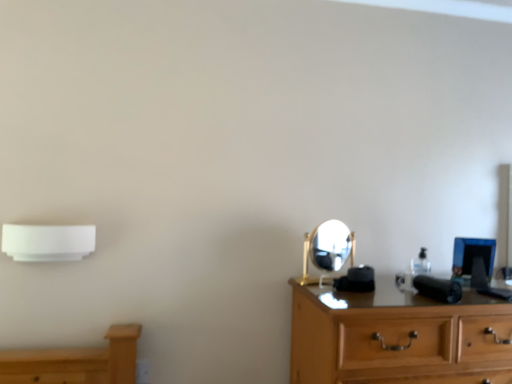
This screenshot has height=384, width=512. Identify the location of free space in front of gold metallic mirror at center. tap(353, 302).